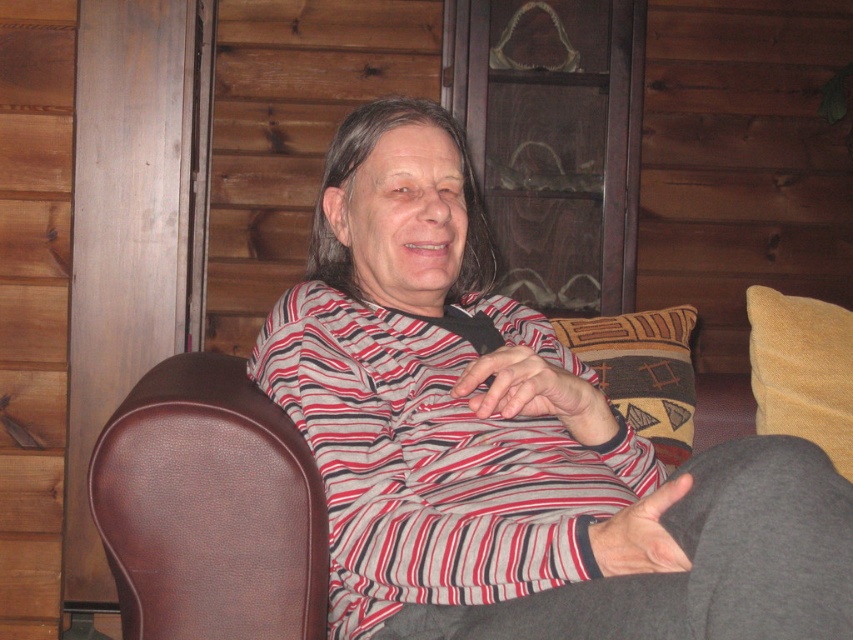
Question: Can you confirm if yellow soft cushion at right is thinner than patterned fabric pillow at center?

Choices:
 (A) no
 (B) yes

Answer: (B)

Question: Which point is farther to the camera?

Choices:
 (A) (503, 324)
 (B) (576, 333)

Answer: (B)

Question: Which object is the closest to the striped fabric shirt at center?

Choices:
 (A) patterned fabric pillow at center
 (B) yellow soft cushion at right

Answer: (A)

Question: Does yellow soft cushion at right have a greater width compared to patterned fabric pillow at center?

Choices:
 (A) yes
 (B) no

Answer: (B)

Question: Is striped fabric shirt at center positioned behind yellow soft cushion at right?

Choices:
 (A) no
 (B) yes

Answer: (A)

Question: Among these objects, which one is nearest to the camera?

Choices:
 (A) yellow soft cushion at right
 (B) striped fabric shirt at center
 (C) patterned fabric pillow at center

Answer: (B)